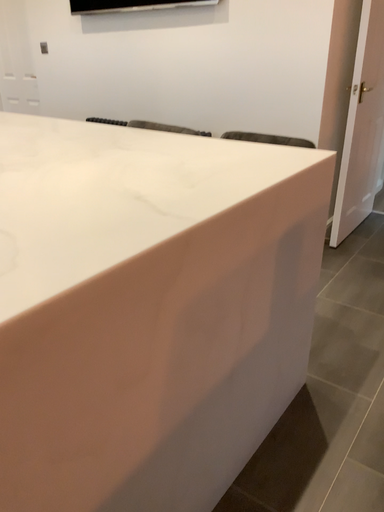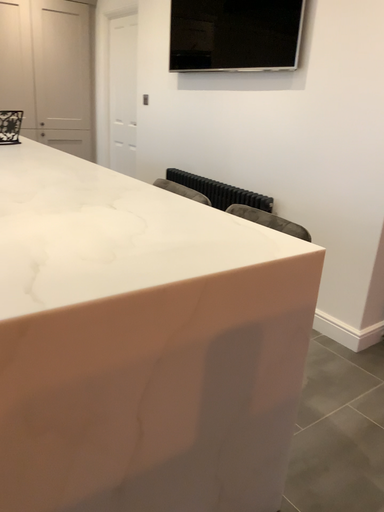
Question: Which way did the camera rotate in the video?

Choices:
 (A) rotated upward
 (B) rotated downward

Answer: (A)